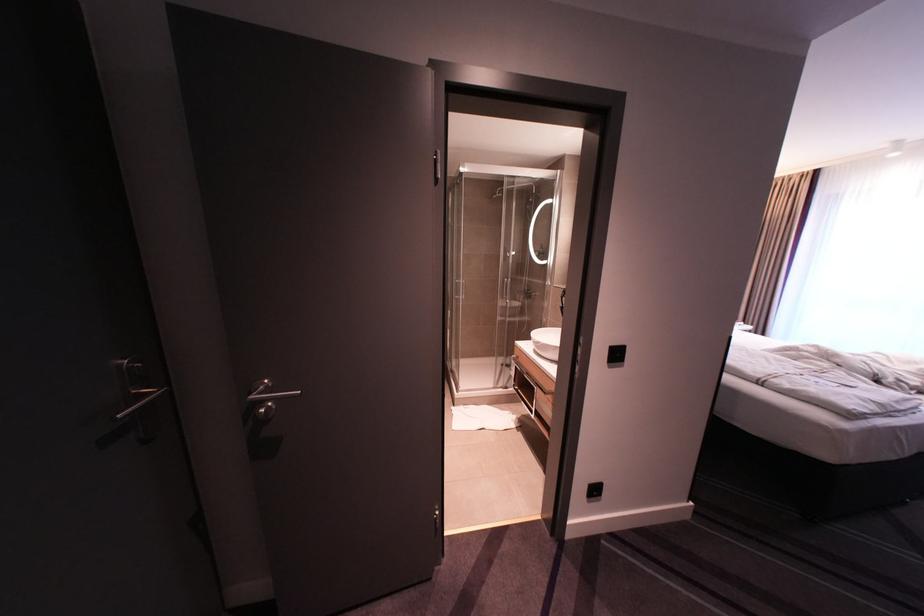
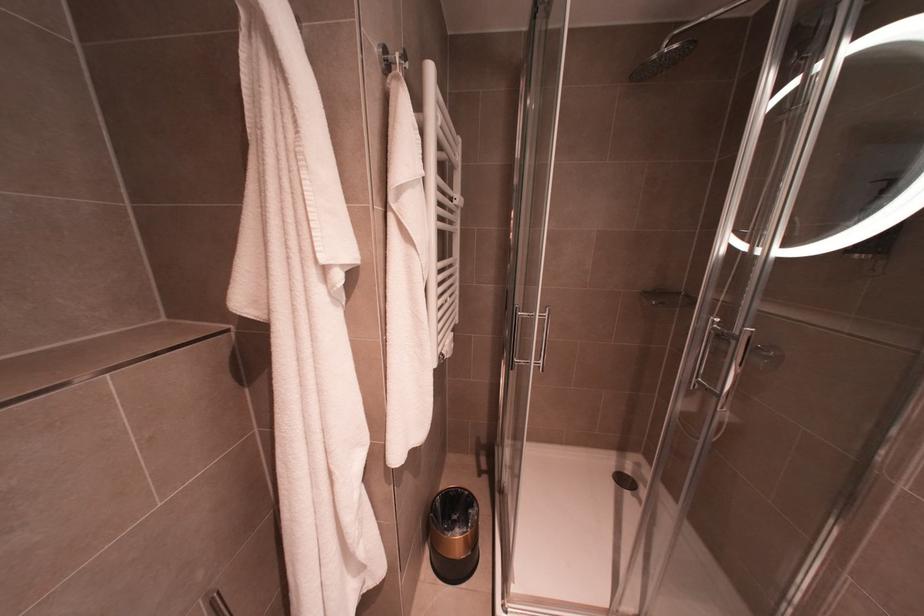
Question: What movement of the cameraman would produce the second image?

Choices:
 (A) Left
 (B) Right
 (C) Forward
 (D) Backward

Answer: (C)